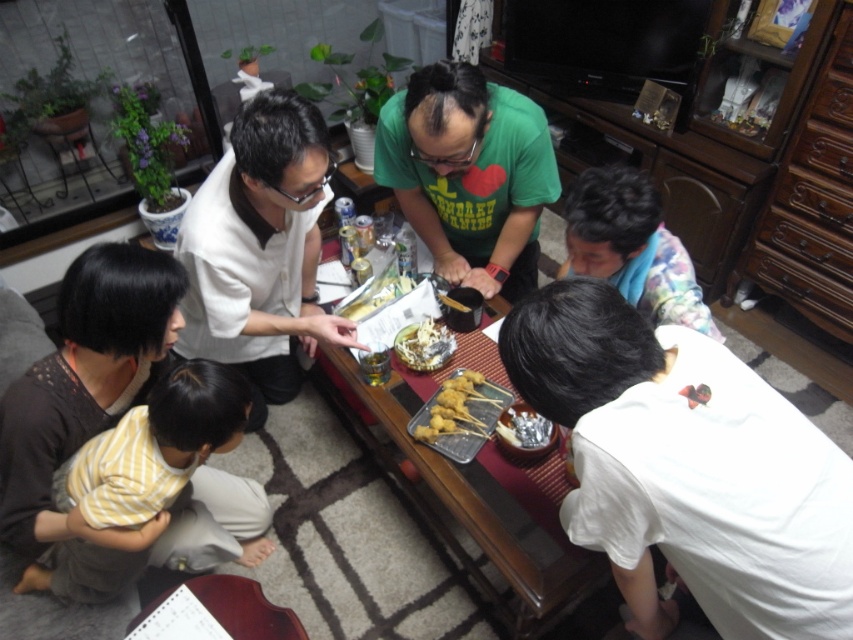
Question: Which object is positioned farthest from the white matte shirt at upper left?

Choices:
 (A) wooden tray at center
 (B) golden crispy skewers at center
 (C) fluffy multicolored blanket at lower right

Answer: (C)

Question: Is yellow striped shirt at lower left further to the viewer compared to matte plastic bowl at center?

Choices:
 (A) no
 (B) yes

Answer: (A)

Question: Which object is farther from the camera taking this photo?

Choices:
 (A) matte plastic bowl at center
 (B) shiny metallic bowl at center
 (C) golden crispy skewers at center

Answer: (A)

Question: Considering the real-world distances, which object is farthest from the white matte shirt at upper left?

Choices:
 (A) matte plastic bowl at center
 (B) wooden tray at center

Answer: (B)

Question: Does yellow striped shirt at lower left have a larger size compared to green matte shirt at center?

Choices:
 (A) yes
 (B) no

Answer: (A)

Question: Can you confirm if wooden tray at center is bigger than yellow striped shirt at lower left?

Choices:
 (A) yes
 (B) no

Answer: (A)